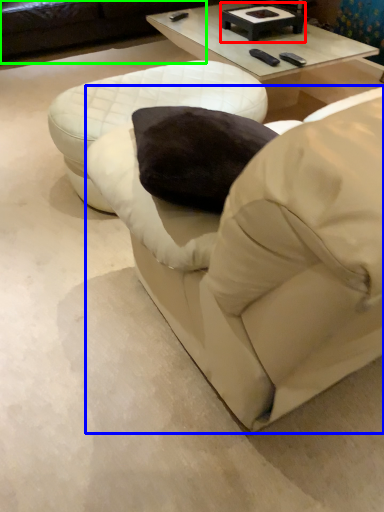
Question: Which object is positioned closest to round table (highlighted by a red box)? Select from bean bag chair (highlighted by a blue box) and studio couch (highlighted by a green box).

Choices:
 (A) bean bag chair
 (B) studio couch

Answer: (B)